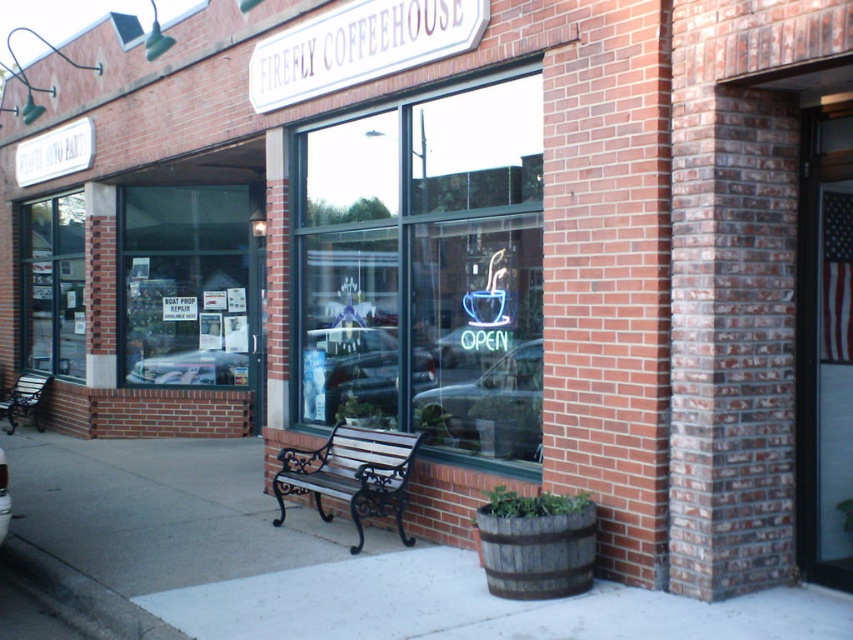
Question: Where is transparent glass window at left located in relation to wooden park bench at lower left in the image?

Choices:
 (A) below
 (B) above

Answer: (B)

Question: Which of the following is the closest to the observer?

Choices:
 (A) (x=456, y=134)
 (B) (x=276, y=525)
 (C) (x=44, y=385)
 (D) (x=351, y=541)

Answer: (A)

Question: From the image, what is the correct spatial relationship of clear glass window at center in relation to transparent glass window at left?

Choices:
 (A) above
 (B) below

Answer: (B)

Question: Which point is closer to the camera?

Choices:
 (A) (33, 394)
 (B) (373, 394)
 (C) (271, 520)
 (D) (61, 332)

Answer: (C)

Question: Can you confirm if neon glass window at center is smaller than transparent glass window at left?

Choices:
 (A) yes
 (B) no

Answer: (B)

Question: Estimate the real-world distances between objects in this image. Which object is farther from the wooden park bench at lower left?

Choices:
 (A) neon glass window at center
 (B) clear glass window at center
 (C) transparent glass window at left
 (D) wooden bench at center

Answer: (A)